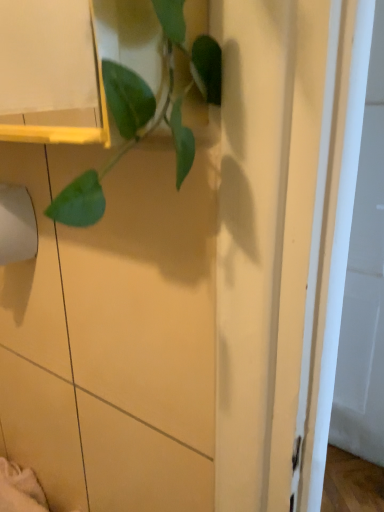
Question: Considering the positions of point (11, 245) and point (185, 52), is point (11, 245) closer or farther from the camera than point (185, 52)?

Choices:
 (A) farther
 (B) closer

Answer: (A)

Question: In terms of height, does white matte toilet paper at left look taller or shorter compared to green leafy plant at upper left?

Choices:
 (A) tall
 (B) short

Answer: (B)

Question: From the image's perspective, is white matte toilet paper at left positioned above or below green leafy plant at upper left?

Choices:
 (A) below
 (B) above

Answer: (A)

Question: Based on their sizes in the image, would you say green leafy plant at upper left is bigger or smaller than white matte toilet paper at left?

Choices:
 (A) big
 (B) small

Answer: (A)

Question: From their relative heights in the image, would you say green leafy plant at upper left is taller or shorter than white matte toilet paper at left?

Choices:
 (A) tall
 (B) short

Answer: (A)

Question: From a real-world perspective, is green leafy plant at upper left physically located above or below white matte toilet paper at left?

Choices:
 (A) above
 (B) below

Answer: (A)

Question: Considering the positions of green leafy plant at upper left and white matte toilet paper at left in the image, is green leafy plant at upper left wider or thinner than white matte toilet paper at left?

Choices:
 (A) thin
 (B) wide

Answer: (A)